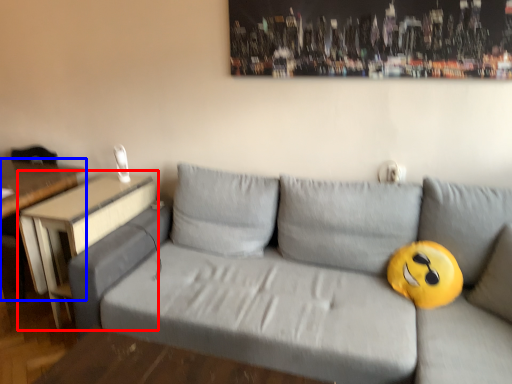
Question: Which object is further to the camera taking this photo, table (highlighted by a red box) or table (highlighted by a blue box)?

Choices:
 (A) table
 (B) table

Answer: (B)